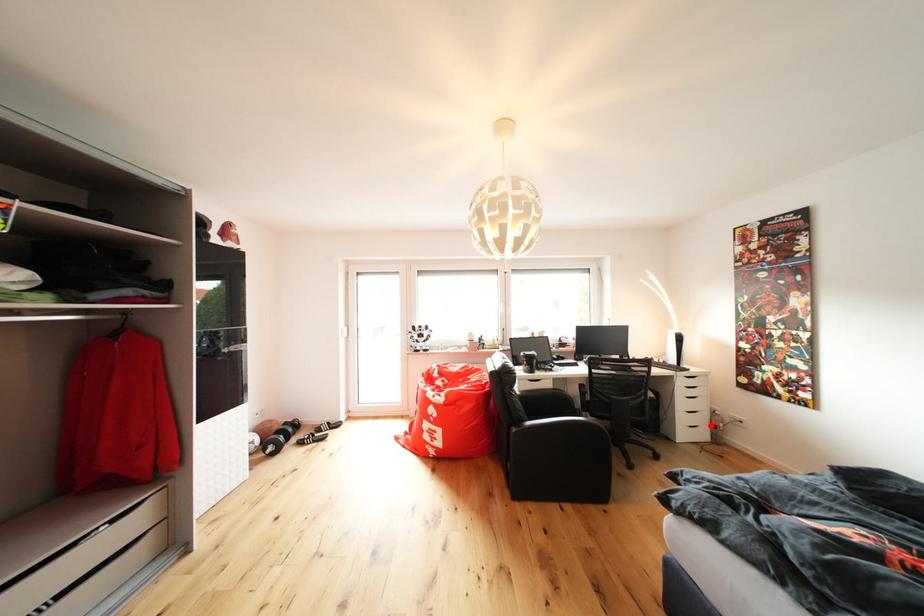
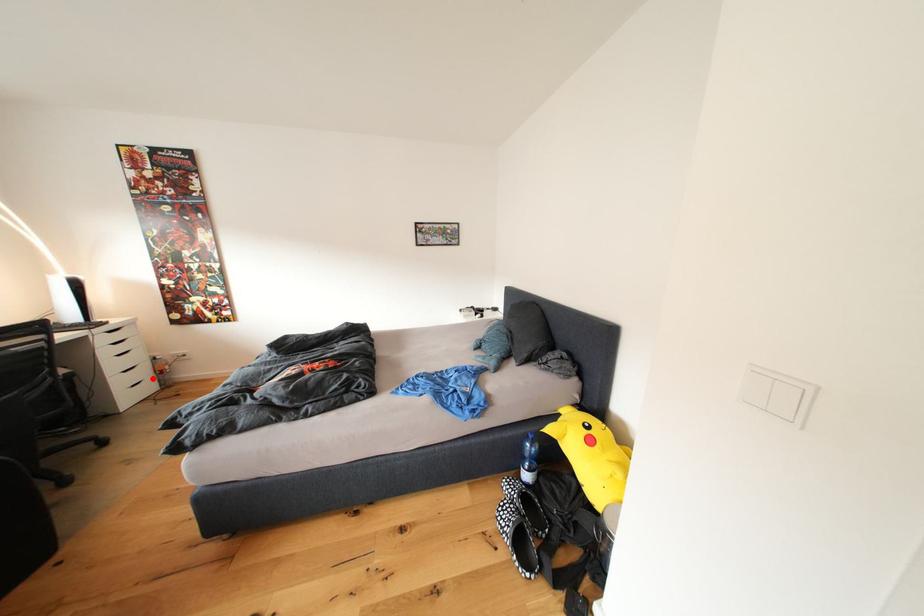
In the scene shown: I am providing you with two images of the same scene from different viewpoints. A red point is marked on the first image and another point is marked on the second image. Are the points marked in image1 and image2 representing the same 3D position?

Yes